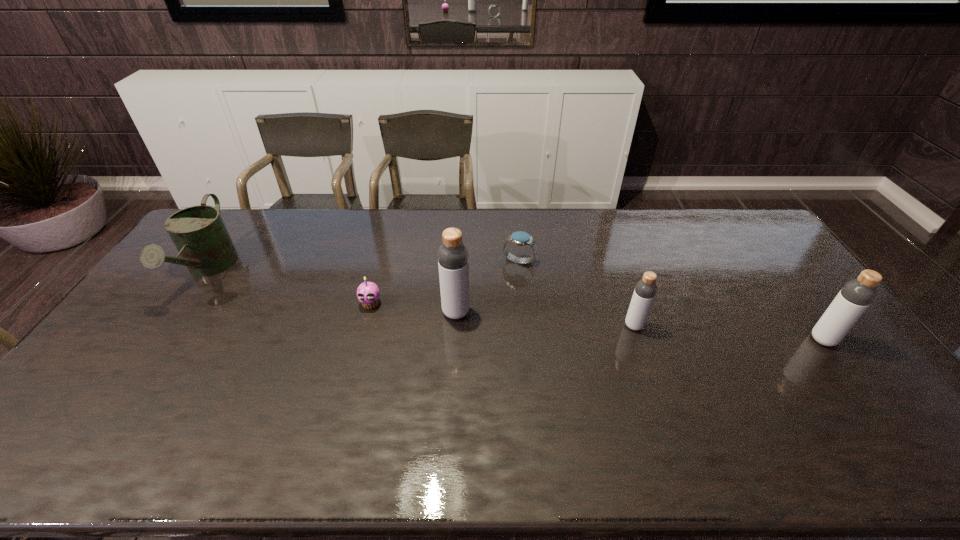
Identify the location of free space at the near edge of the desktop. (616, 404).

Identify the location of free region at the left edge. Image resolution: width=960 pixels, height=540 pixels. (138, 326).

Identify the location of vacant space at the near left corner. (76, 404).

This screenshot has height=540, width=960. Identify the location of free location at the far right corner of the desktop. (713, 216).

The image size is (960, 540). Find the location of `free area in between the tallest bottle and the watering can`. free area in between the tallest bottle and the watering can is located at coordinates (332, 291).

What are the coordinates of `blank region between the leftmost object and the rightmost object` in the screenshot? It's located at (516, 305).

Where is `vacant point located between the second object from left to right and the second tallest bottle`? This screenshot has height=540, width=960. vacant point located between the second object from left to right and the second tallest bottle is located at coordinates (597, 322).

Where is `free space between the fourth object from left to right and the tallest object`? The image size is (960, 540). free space between the fourth object from left to right and the tallest object is located at coordinates (488, 287).

Where is `vacant point located between the rightmost bottle and the leftmost object`? vacant point located between the rightmost bottle and the leftmost object is located at coordinates coord(516,305).

The image size is (960, 540). What are the coordinates of `unoccupied area between the second bottle from left to right and the tallest object` in the screenshot? It's located at (545, 319).